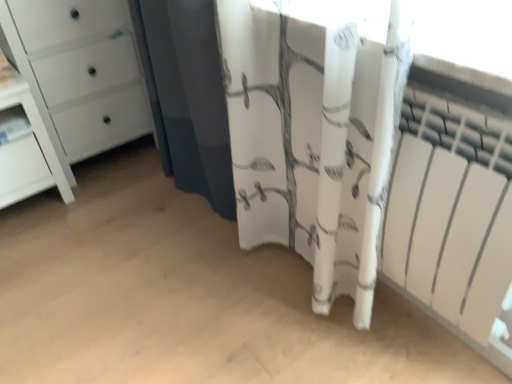
Question: Is white matte radiator at right bigger than white fabric curtain at center?

Choices:
 (A) no
 (B) yes

Answer: (A)

Question: Is white matte radiator at right positioned beyond the bounds of white fabric curtain at center?

Choices:
 (A) yes
 (B) no

Answer: (B)

Question: From the image's perspective, is white matte radiator at right below white fabric curtain at center?

Choices:
 (A) yes
 (B) no

Answer: (A)

Question: Is white matte radiator at right to the left of white fabric curtain at center from the viewer's perspective?

Choices:
 (A) yes
 (B) no

Answer: (B)

Question: Considering the relative sizes of white matte radiator at right and white fabric curtain at center in the image provided, is white matte radiator at right shorter than white fabric curtain at center?

Choices:
 (A) yes
 (B) no

Answer: (A)

Question: From the image's perspective, is white fabric curtain at center located above or below white glossy chest of drawers at left?

Choices:
 (A) above
 (B) below

Answer: (B)

Question: Does point (373, 140) appear closer or farther from the camera than point (129, 139)?

Choices:
 (A) farther
 (B) closer

Answer: (B)

Question: Based on their positions, is white fabric curtain at center located to the left or right of white glossy chest of drawers at left?

Choices:
 (A) left
 (B) right

Answer: (B)

Question: Is white fabric curtain at center in front of or behind white glossy chest of drawers at left in the image?

Choices:
 (A) front
 (B) behind

Answer: (A)

Question: Is white glossy bookshelf at left in front of or behind white floral fabric at center in the image?

Choices:
 (A) behind
 (B) front

Answer: (A)

Question: Would you say white glossy bookshelf at left is to the left or to the right of white floral fabric at center in the picture?

Choices:
 (A) left
 (B) right

Answer: (A)

Question: From a real-world perspective, is white glossy bookshelf at left positioned above or below white floral fabric at center?

Choices:
 (A) below
 (B) above

Answer: (A)

Question: From the image's perspective, is white glossy bookshelf at left positioned above or below white floral fabric at center?

Choices:
 (A) below
 (B) above

Answer: (A)

Question: Does point (30, 130) appear closer or farther from the camera than point (480, 216)?

Choices:
 (A) closer
 (B) farther

Answer: (B)

Question: Looking at the image, does white glossy bookshelf at left seem bigger or smaller compared to white matte radiator at right?

Choices:
 (A) small
 (B) big

Answer: (A)